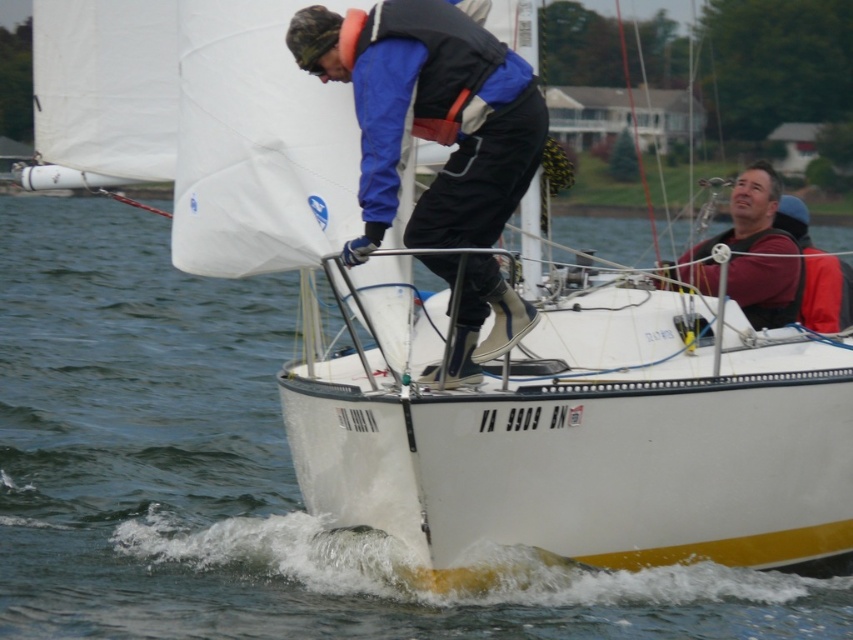
From the picture: Can you confirm if matte blue jacket at center is positioned below maroon fabric life vest at upper right?

Yes, matte blue jacket at center is below maroon fabric life vest at upper right.

Which is more to the left, matte blue jacket at center or maroon fabric life vest at upper right?

matte blue jacket at center

Looking at this image, who is more distant from viewer, (451, 182) or (772, 192)?

Positioned behind is point (772, 192).

Where is `matte blue jacket at center`? Image resolution: width=853 pixels, height=640 pixels. matte blue jacket at center is located at coordinates (428, 113).

Which is below, white water at center or maroon fabric life vest at upper right?

white water at center is below.

Which is behind, point (128, 561) or point (757, 172)?

Positioned behind is point (757, 172).

Between point (318, 568) and point (775, 244), which one is positioned in front?

Point (318, 568) is in front.

Where is `white water at center`? Image resolution: width=853 pixels, height=640 pixels. white water at center is located at coordinates (242, 476).

Is white water at center thinner than matte blue jacket at center?

In fact, white water at center might be wider than matte blue jacket at center.

Between point (274, 426) and point (367, 19), which one is positioned behind?

The point (274, 426) is more distant.

At what (x,y) coordinates should I click in order to perform the action: click on white water at center. Please return your answer as a coordinate pair (x, y). Looking at the image, I should click on (242, 476).